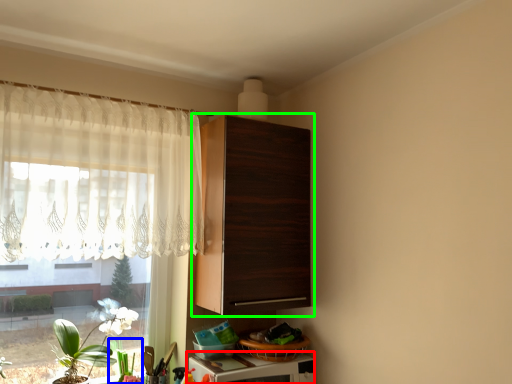
Question: Estimate the real-world distances between objects in this image. Which object is closer to appliance (highlighted by a red box), plant (highlighted by a blue box) or cabinetry (highlighted by a green box)?

Choices:
 (A) plant
 (B) cabinetry

Answer: (A)